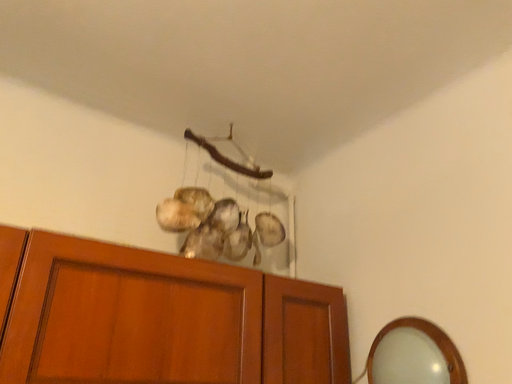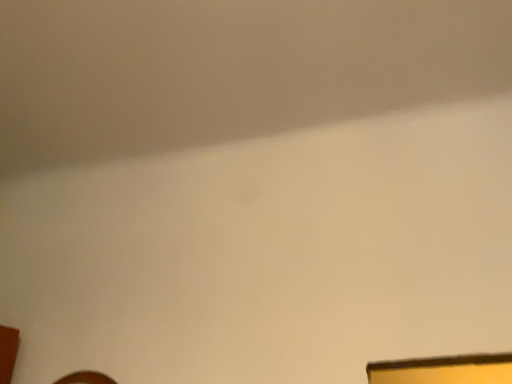
Question: How did the camera likely rotate when shooting the video?

Choices:
 (A) rotated right
 (B) rotated left

Answer: (A)